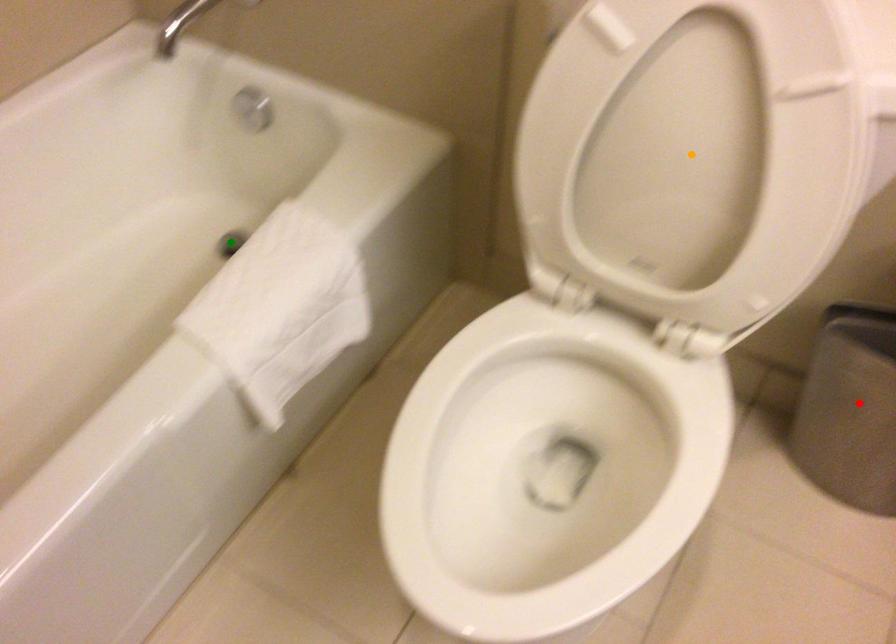
Order these from nearest to farthest:
orange point | green point | red point

orange point → red point → green point